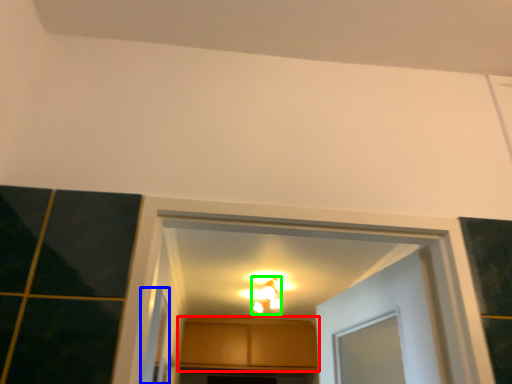
Question: Considering the real-world distances, which object is farthest from cabinetry (highlighted by a red box)? screen door (highlighted by a blue box) or light fixture (highlighted by a green box)?

Choices:
 (A) screen door
 (B) light fixture

Answer: (A)